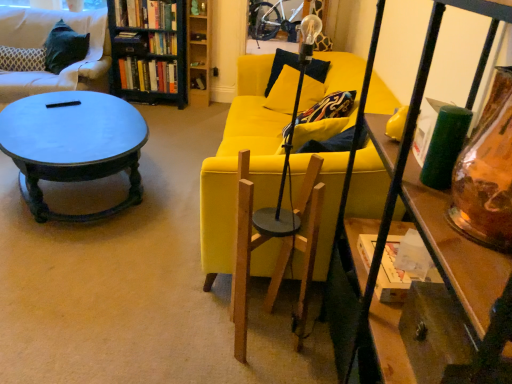
The height and width of the screenshot is (384, 512). Find the location of `free space in front of black painted wood bookcase at upper left`. free space in front of black painted wood bookcase at upper left is located at coordinates (164, 114).